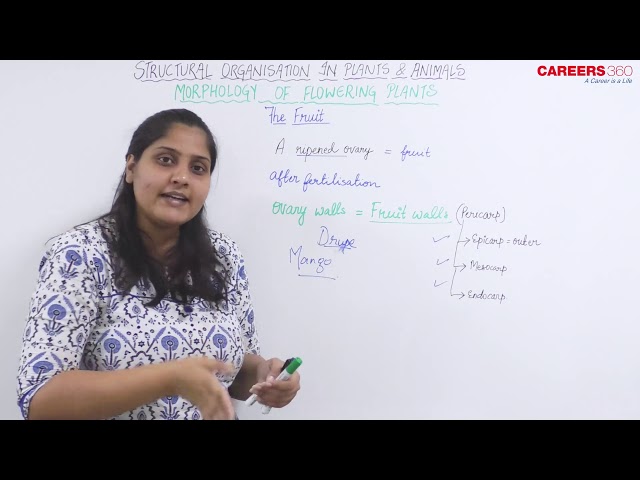
In order to click on board in this screenshot , I will do `click(486, 148)`.